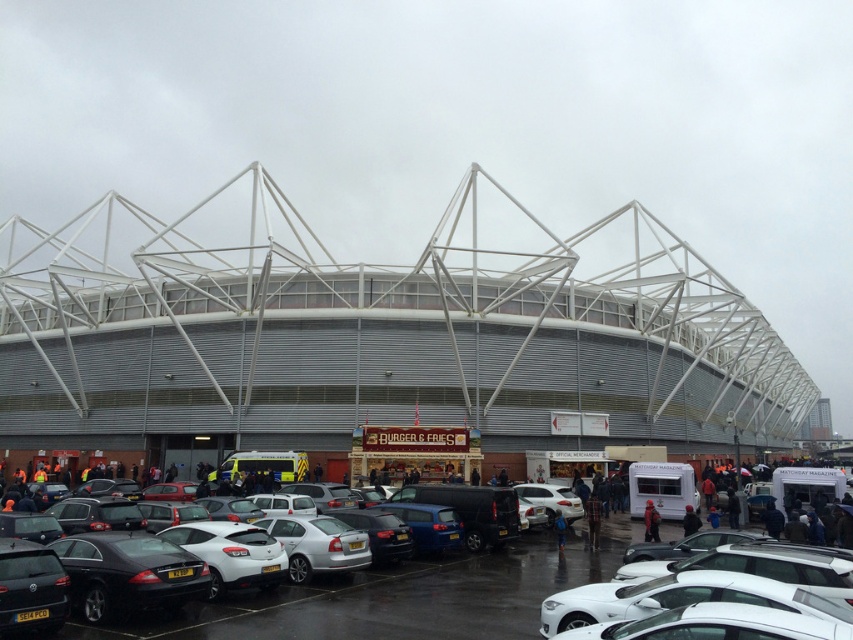
Question: Can you confirm if black glossy sedan at lower left is wider than matte black car at lower left?

Choices:
 (A) yes
 (B) no

Answer: (B)

Question: Can you confirm if metallic cars at center is bigger than silver metallic sedan at center?

Choices:
 (A) no
 (B) yes

Answer: (B)

Question: Does metallic cars at center have a greater width compared to silver metallic sedan at center?

Choices:
 (A) yes
 (B) no

Answer: (A)

Question: Based on their relative distances, which object is nearer to the black glossy sedan at lower left?

Choices:
 (A) metallic cars at center
 (B) white matte car at center
 (C) silver metallic sedan at center

Answer: (C)

Question: Which object is the closest to the white matte car at center?

Choices:
 (A) black glossy sedan at lower left
 (B) metallic cars at center

Answer: (B)

Question: Based on their relative distances, which object is nearer to the matte black car at lower left?

Choices:
 (A) silver metallic sedan at center
 (B) white matte car at center
 (C) metallic cars at center
 (D) black glossy sedan at lower left

Answer: (D)